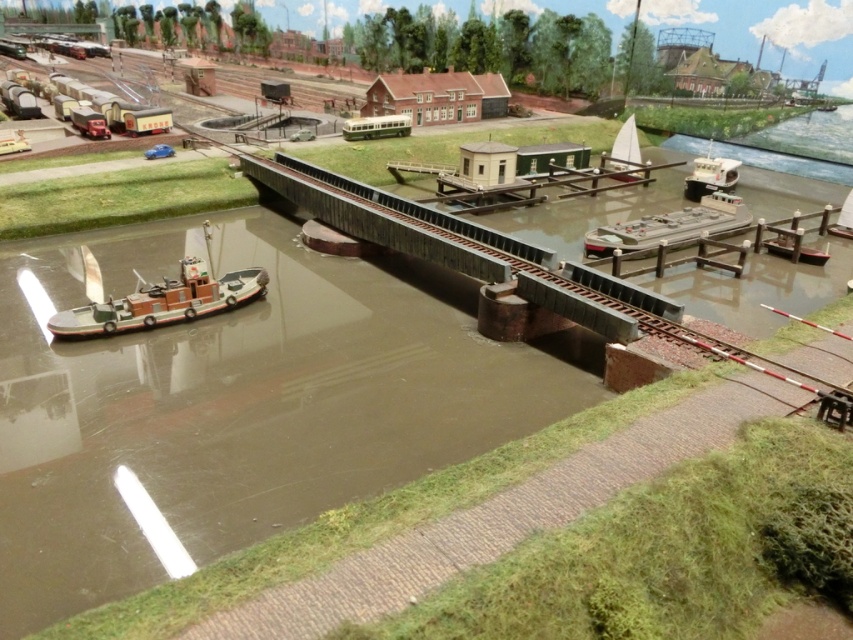
You are a model boat enthusiast planning to sail a new boat in the brown matte waterway at center. The boat you have is the same size as the white matte sailboat at upper center. Can the waterway accommodate your boat comfortably?

The brown matte waterway at center is larger in size than the white matte sailboat at upper center, so yes, the waterway can accommodate your boat comfortably since it is bigger than the boat.